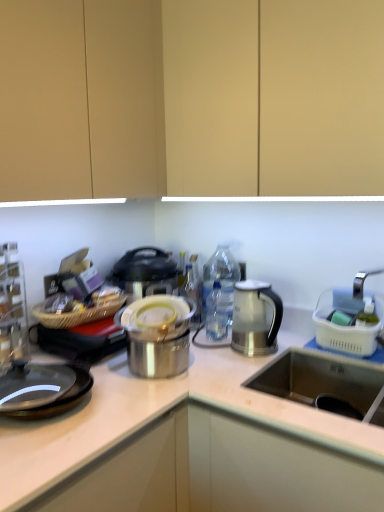
The image size is (384, 512). What are the coordinates of `vacant area that lies to the right of shiny metallic pot at center, positioned as the 2th appliance in right-to-left order` in the screenshot? It's located at pyautogui.click(x=208, y=370).